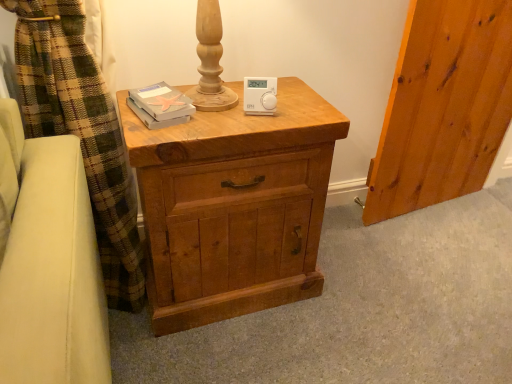
Locate an element on the screen. The image size is (512, 384). free location to the left of white plastic thermostat at center is located at coordinates (204, 108).